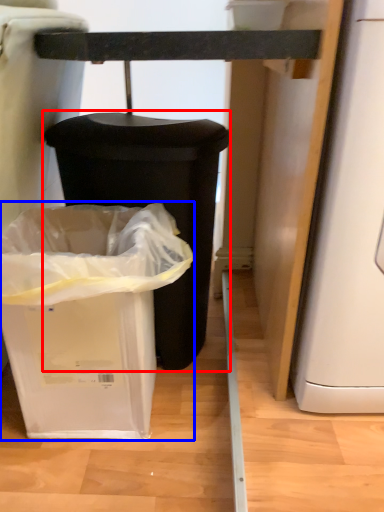
Question: Among these objects, which one is farthest to the camera, waste container (highlighted by a red box) or waste container (highlighted by a blue box)?

Choices:
 (A) waste container
 (B) waste container

Answer: (A)